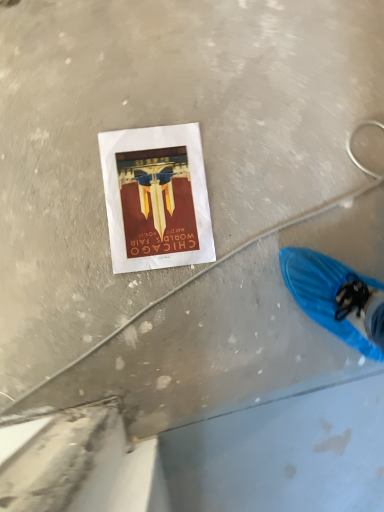
This screenshot has height=512, width=384. Identify the location of vacant space situated on the left part of matte paper poster at center. (75, 154).